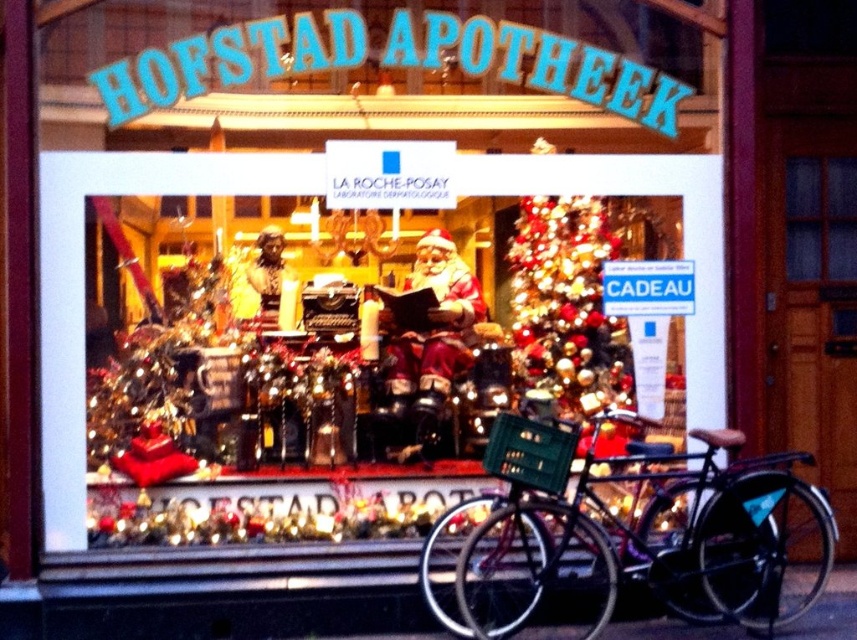
From the picture: You are a delivery person who needs to park your bicycle 5 feet away from the clear glass window at upper right to avoid breaking it. Can you park your matte black bicycle at lower right at the required distance?

The matte black bicycle at lower right and clear glass window at upper right are 6.38 feet apart from each other. Since 6.38 feet is greater than 5 feet, the bicycle is already parked at a safe distance from the clear glass window at upper right.

You are a delivery person standing in front of the pharmacy window. You need to place a package on the clear glass window at upper right but there is a shiny gold ornaments at center in the way. Can you move the ornaments to make space?

The shiny gold ornaments at center are 4.52 feet away from the clear glass window at upper right. Since the distance is more than enough, you can move the ornaments to create space without any issue.